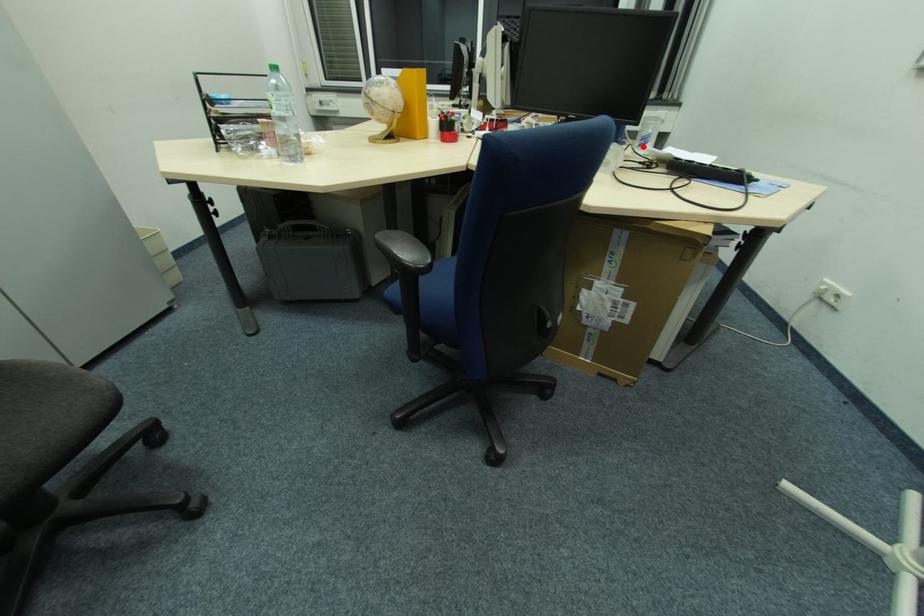
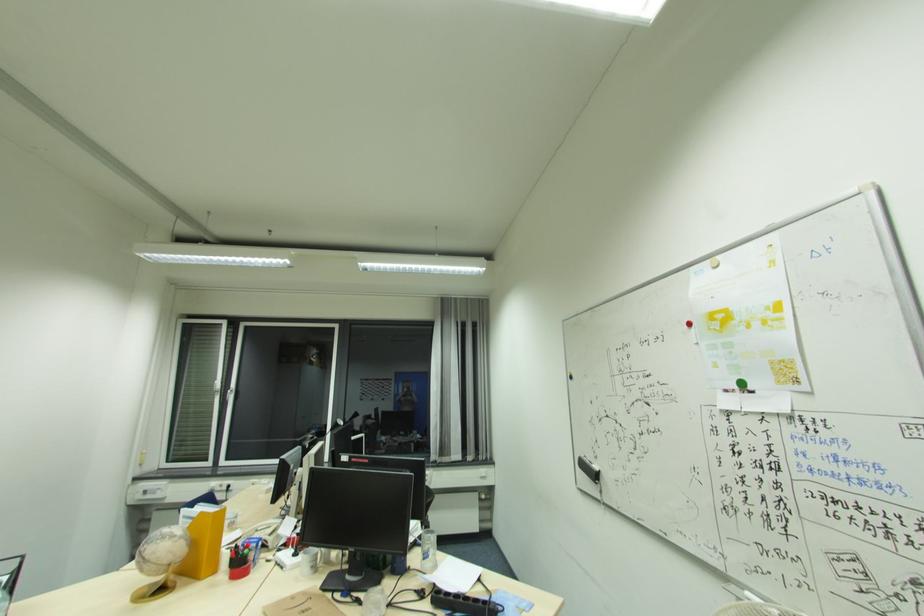
Question: I am providing you with two images of the same scene from different viewpoints. Given a red point in image1, look at the same physical point in image2. Is it:

Choices:
 (A) Closer to the viewpoint
 (B) Farther from the viewpoint

Answer: (B)